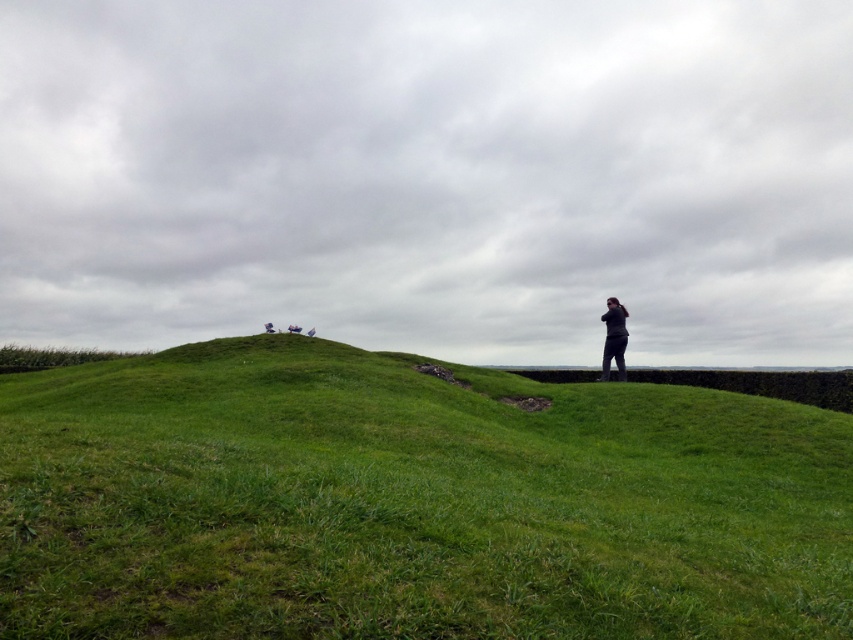
You are planning to set up a small tent for a picnic. You have two options for locations on the image provided. One is on the green grassy hillside at center and the other is near the dark gray fabric person at right. Considering the size of the areas, which location would provide more space for your tent?

The green grassy hillside at center is larger in size than the dark gray fabric person at right, so setting up the tent on the green grassy hillside at center would provide more space.

You are standing on the green grassy hillside at center and want to walk to the dark gray fabric person at right. Which direction should you move to reach them?

You should move to the right because the dark gray fabric person at right is located to the right of the green grassy hillside at center.

Based on the coordinates provided, where is the green grassy hillside at center located in the image?

The green grassy hillside at center is located at the 2D coordinates point of (x=410, y=502).